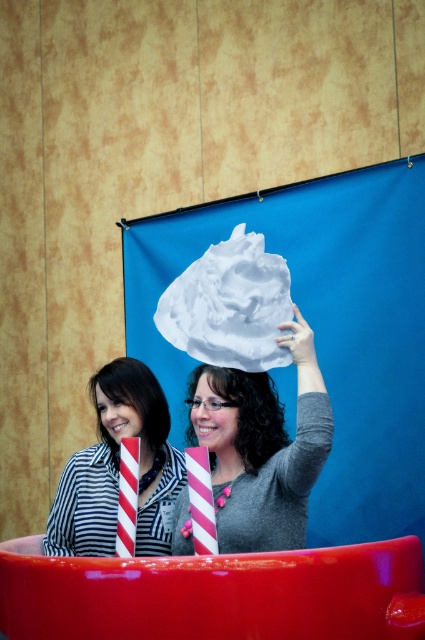
Question: Which point is closer to the camera?

Choices:
 (A) (207, 369)
 (B) (153, 449)
 (C) (240, 291)
 (D) (65, 541)

Answer: (C)

Question: Can you confirm if white matte paper at upper center is bigger than striped fabric shirt at left?

Choices:
 (A) yes
 (B) no

Answer: (A)

Question: Can you confirm if white matte paper at upper center is thinner than white matte cloud at upper center?

Choices:
 (A) no
 (B) yes

Answer: (A)

Question: Which object is the closest to the white matte cloud at upper center?

Choices:
 (A) white matte foam at upper center
 (B) white matte paper at upper center
 (C) striped fabric shirt at left
 (D) smooth black hair at center

Answer: (B)

Question: Which object appears farthest from the camera in this image?

Choices:
 (A) smooth black hair at center
 (B) striped fabric shirt at left
 (C) white matte cloud at upper center
 (D) white matte foam at upper center

Answer: (A)

Question: Is the position of striped fabric shirt at left more distant than that of smooth black hair at center?

Choices:
 (A) no
 (B) yes

Answer: (A)